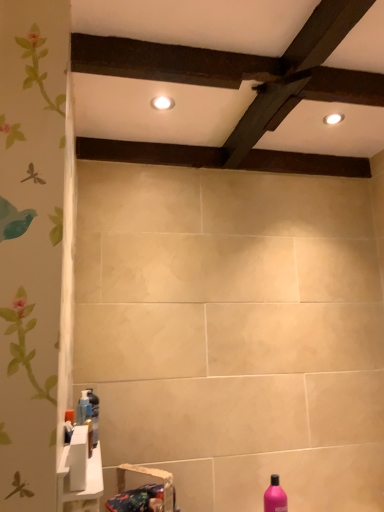
Question: Is white glossy sink at lower left, arranged as the 2th sink when ordered from the bottom, to the left or to the right of dark brown wood at upper center in the image?

Choices:
 (A) left
 (B) right

Answer: (A)

Question: From the image's perspective, is white glossy sink at lower left, the 1th sink in the top-to-bottom sequence, positioned above or below dark brown wood at upper center?

Choices:
 (A) above
 (B) below

Answer: (B)

Question: Estimate the real-world distances between objects in this image. Which object is farther from the dark brown wood at upper center?

Choices:
 (A) white glossy sink at lower left, the 1th sink in the top-to-bottom sequence
 (B) translucent plastic bottle at lower left, marked as the 1th bottle in a left-to-right arrangement
 (C) blue fabric sink at lower left, the second sink viewed from the top
 (D) pink glossy bottle at lower right, acting as the first bottle starting from the bottom
 (E) white glossy light fixture at upper right, acting as the 1th lighting starting from the back

Answer: (D)

Question: Based on their relative distances, which object is farther from the translucent plastic bottle at lower left, the second bottle positioned from the bottom?

Choices:
 (A) white glossy light fixture at upper right, acting as the 1th lighting starting from the back
 (B) white glossy sink at lower left, arranged as the 2th sink when ordered from the bottom
 (C) pink glossy bottle at lower right, acting as the first bottle starting from the bottom
 (D) dark brown wood at upper center
 (E) blue fabric sink at lower left, the second sink viewed from the top

Answer: (A)